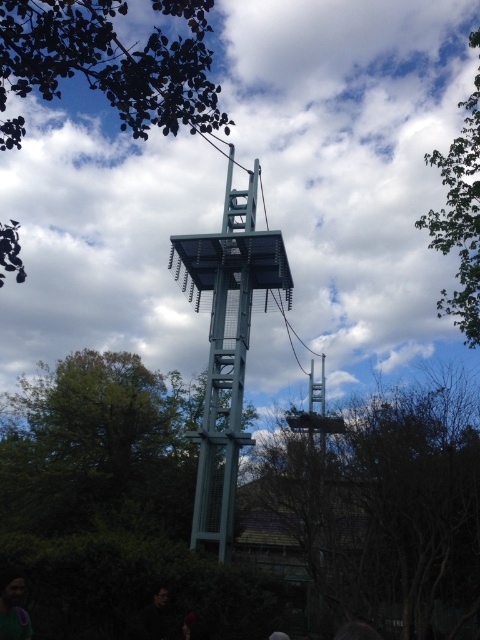
You are standing at the base of the structure and want to take a photo of both the brown leafy tree at center and the metallic gray bell tower at center. Which object should you focus on first to ensure both are in sharp focus?

You should focus on the brown leafy tree at center first because it is closer to the viewer than the metallic gray bell tower at center, so adjusting focus from near to far will help both be in sharp focus.

From the picture: You are a visitor at the zoo and want to take a photo of both the brown leafy tree at center and the metallic gray bell tower at center. Which object should you focus on first if you want to include both in your frame without zooming in?

The brown leafy tree at center is larger in size than the metallic gray bell tower at center, so you should focus on the metallic gray bell tower at center first to ensure both fit in the frame.

You are standing at the base of the tall structure in the zoo. Looking up, you notice a specific point marked at coordinates point (112, 60). What is located at that point?

The point (112, 60) marks dark green leaves at upper center.